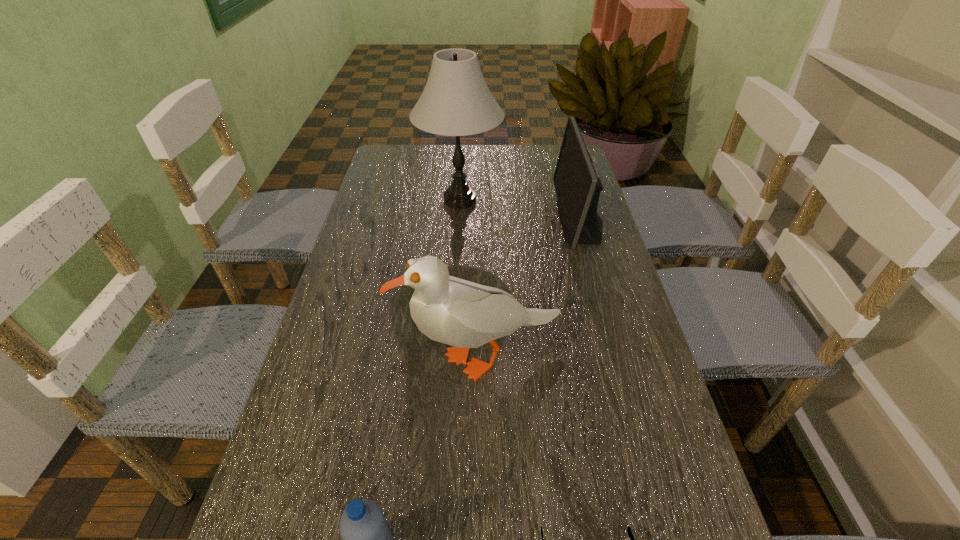
Identify the location of object positioned at the right edge. (577, 186).

You are a GUI agent. You are given a task and a screenshot of the screen. Output one action in this format:
    pyautogui.click(x=<x>, y=<y>)
    Task: Click on the free space at the far edge of the desktop
    The image size is (960, 540).
    Given the screenshot: What is the action you would take?
    pyautogui.click(x=510, y=145)

At what (x,y) coordinates should I click in order to perform the action: click on free space at the left edge of the desktop. Please return your answer as a coordinate pair (x, y). Looking at the image, I should click on (403, 245).

This screenshot has height=540, width=960. I want to click on blank space at the right edge, so click(567, 313).

Locate an element on the screen. free location at the far left corner of the desktop is located at coordinates (392, 156).

Locate an element on the screen. blank region between the computer monitor and the third nearest object is located at coordinates (532, 290).

Where is `vacant space in between the gull and the third shortest object`? vacant space in between the gull and the third shortest object is located at coordinates (532, 290).

Locate an element on the screen. The width and height of the screenshot is (960, 540). object identified as the second closest to the third farthest object is located at coordinates tap(367, 539).

Locate which object ranks third in proximity to the water bottle. Please provide its 2D coordinates. Your answer should be formatted as a tuple, i.e. [(x, y)], where the tuple contains the x and y coordinates of a point satisfying the conditions above.

[(577, 186)]